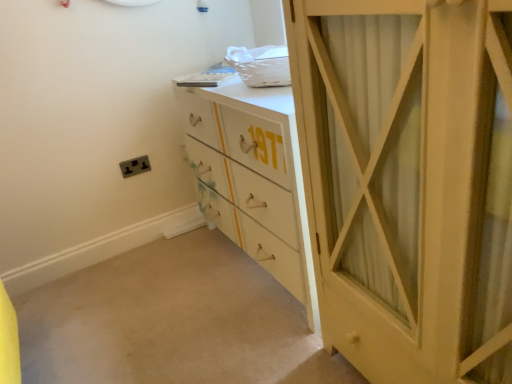
Question: Considering the relative sizes of matte white cabinet at right and matte black socket at lower left in the image provided, is matte white cabinet at right smaller than matte black socket at lower left?

Choices:
 (A) no
 (B) yes

Answer: (A)

Question: Does matte white cabinet at right contain matte black socket at lower left?

Choices:
 (A) no
 (B) yes

Answer: (A)

Question: Is the surface of matte white cabinet at right in direct contact with matte black socket at lower left?

Choices:
 (A) no
 (B) yes

Answer: (A)

Question: Is matte white cabinet at right to the right of matte black socket at lower left from the viewer's perspective?

Choices:
 (A) yes
 (B) no

Answer: (A)

Question: Is matte white cabinet at right bigger than matte black socket at lower left?

Choices:
 (A) no
 (B) yes

Answer: (B)

Question: In terms of height, does matte black socket at lower left look taller or shorter compared to matte white cabinet at right?

Choices:
 (A) tall
 (B) short

Answer: (B)

Question: From the image's perspective, relative to matte white cabinet at right, is matte black socket at lower left above or below?

Choices:
 (A) below
 (B) above

Answer: (B)

Question: Based on their positions, is matte black socket at lower left located to the left or right of matte white cabinet at right?

Choices:
 (A) left
 (B) right

Answer: (A)

Question: Considering the positions of point coord(139,160) and point coord(442,170), is point coord(139,160) closer or farther from the camera than point coord(442,170)?

Choices:
 (A) closer
 (B) farther

Answer: (B)

Question: Considering the positions of matte white cabinet at right and matte black socket at lower left in the image, is matte white cabinet at right wider or thinner than matte black socket at lower left?

Choices:
 (A) thin
 (B) wide

Answer: (B)

Question: Considering the positions of matte white cabinet at right and matte black socket at lower left in the image, is matte white cabinet at right bigger or smaller than matte black socket at lower left?

Choices:
 (A) big
 (B) small

Answer: (A)

Question: From the image's perspective, relative to matte black socket at lower left, is matte white cabinet at right above or below?

Choices:
 (A) above
 (B) below

Answer: (B)

Question: Relative to matte black socket at lower left, is matte white cabinet at right in front or behind?

Choices:
 (A) behind
 (B) front

Answer: (B)

Question: In terms of height, does white painted wood chest of drawers at center look taller or shorter compared to matte white cabinet at right?

Choices:
 (A) tall
 (B) short

Answer: (B)

Question: Would you say white painted wood chest of drawers at center is to the left or to the right of matte white cabinet at right in the picture?

Choices:
 (A) left
 (B) right

Answer: (A)